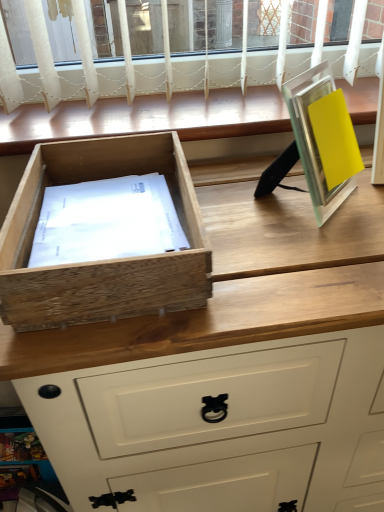
Question: In terms of width, does metallic silver picture frame at right look wider or thinner when compared to wooden window sill at upper center?

Choices:
 (A) thin
 (B) wide

Answer: (A)

Question: In terms of height, does metallic silver picture frame at right look taller or shorter compared to wooden window sill at upper center?

Choices:
 (A) tall
 (B) short

Answer: (A)

Question: Which of these objects is positioned closest to the natural wood drawer at left?

Choices:
 (A) metallic silver picture frame at right
 (B) wooden window sill at upper center
 (C) natural wood chest of drawers at center

Answer: (C)

Question: Considering the real-world distances, which object is closest to the natural wood chest of drawers at center?

Choices:
 (A) natural wood drawer at left
 (B) metallic silver picture frame at right
 (C) wooden window sill at upper center

Answer: (A)